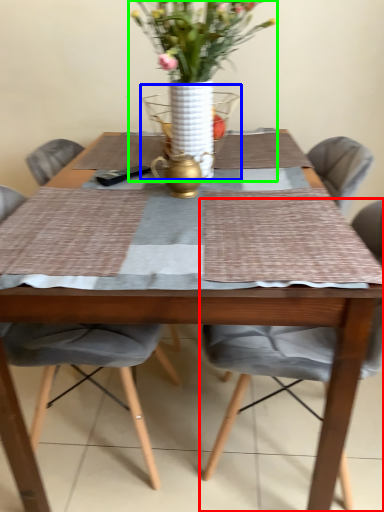
Question: Considering the real-world distances, which object is farthest from chair (highlighted by a red box)? glass vase (highlighted by a blue box) or houseplant (highlighted by a green box)?

Choices:
 (A) glass vase
 (B) houseplant

Answer: (A)